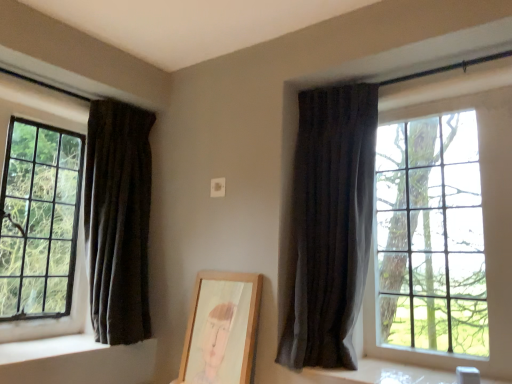
Question: Can you confirm if dark fabric curtain at left, arranged as the 1th curtain when viewed from the left, is positioned to the right of white smooth window sill at lower left, placed as the second window sill when sorted from right to left?

Choices:
 (A) no
 (B) yes

Answer: (B)

Question: Is dark fabric curtain at left, which is the second curtain in right-to-left order, turned away from white smooth window sill at lower left, placed as the second window sill when sorted from right to left?

Choices:
 (A) yes
 (B) no

Answer: (B)

Question: From the image's perspective, is dark fabric curtain at left, arranged as the 1th curtain when viewed from the left, on top of white smooth window sill at lower left, which is the first window sill in left-to-right order?

Choices:
 (A) no
 (B) yes

Answer: (B)

Question: Considering the relative sizes of dark fabric curtain at left, which is the second curtain in right-to-left order, and white smooth window sill at lower left, which is the first window sill in left-to-right order, in the image provided, is dark fabric curtain at left, which is the second curtain in right-to-left order, taller than white smooth window sill at lower left, which is the first window sill in left-to-right order,?

Choices:
 (A) yes
 (B) no

Answer: (A)

Question: Does dark fabric curtain at left, arranged as the 1th curtain when viewed from the left, have a lesser height compared to white smooth window sill at lower left, placed as the second window sill when sorted from right to left?

Choices:
 (A) no
 (B) yes

Answer: (A)

Question: Does dark fabric curtain at left, which is the second curtain in right-to-left order, lie in front of white smooth window sill at lower left, placed as the second window sill when sorted from right to left?

Choices:
 (A) no
 (B) yes

Answer: (A)

Question: From the image's perspective, does white smooth window sill at lower left, which is the first window sill in left-to-right order, appear higher than dark fabric curtain at left, which is the second curtain in right-to-left order?

Choices:
 (A) no
 (B) yes

Answer: (A)

Question: Can you confirm if white smooth window sill at lower left, placed as the second window sill when sorted from right to left, is wider than dark fabric curtain at left, which is the second curtain in right-to-left order?

Choices:
 (A) yes
 (B) no

Answer: (A)

Question: Is white smooth window sill at lower left, placed as the second window sill when sorted from right to left, looking in the opposite direction of dark fabric curtain at left, which is the second curtain in right-to-left order?

Choices:
 (A) yes
 (B) no

Answer: (A)

Question: Is white smooth window sill at lower left, which is the first window sill in left-to-right order, thinner than dark fabric curtain at left, which is the second curtain in right-to-left order?

Choices:
 (A) yes
 (B) no

Answer: (B)

Question: Could you tell me if white smooth window sill at lower left, which is the first window sill in left-to-right order, is facing dark fabric curtain at left, arranged as the 1th curtain when viewed from the left?

Choices:
 (A) yes
 (B) no

Answer: (A)

Question: Does white smooth window sill at lower left, placed as the second window sill when sorted from right to left, appear on the right side of dark fabric curtain at left, which is the second curtain in right-to-left order?

Choices:
 (A) yes
 (B) no

Answer: (B)

Question: Is dark fabric curtain at left, which is the second curtain in right-to-left order, inside wooden picture frame at center?

Choices:
 (A) yes
 (B) no

Answer: (B)